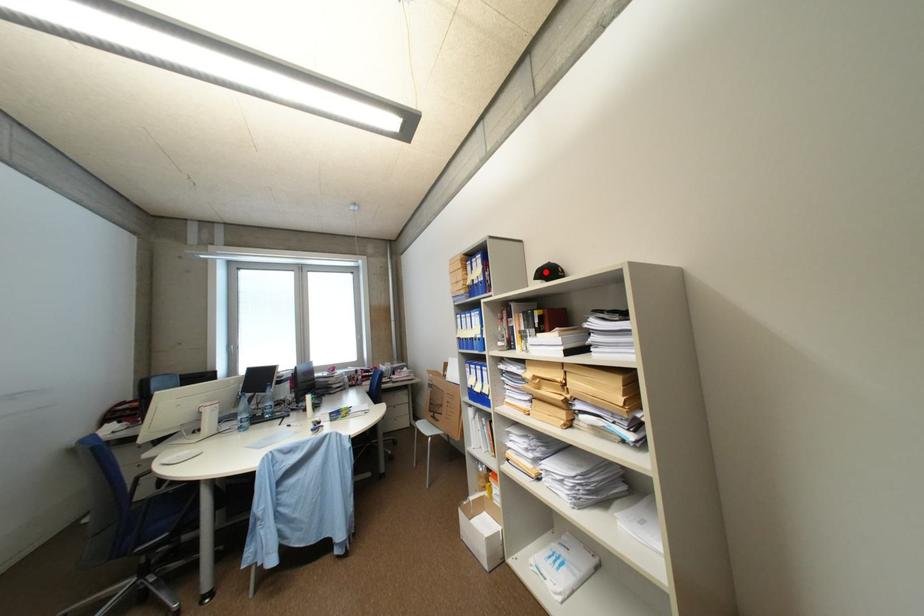
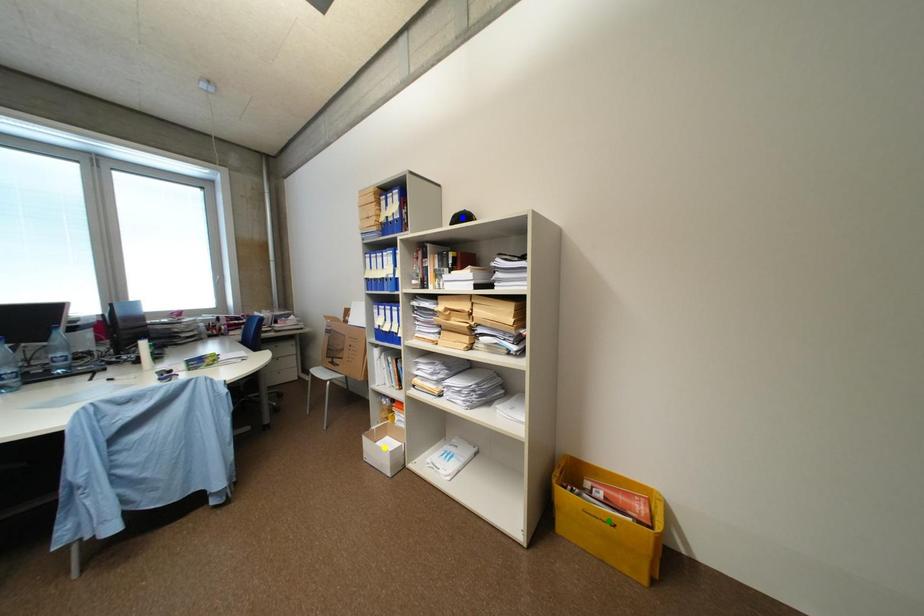
Question: I am providing you with two images of the same scene from different viewpoints. A red point is marked on the first image. You are given multiple points on the second image. Which point in image 2 is actually the same real-world point as the red point in image 1?

Choices:
 (A) yellow point
 (B) blue point
 (C) green point

Answer: (B)